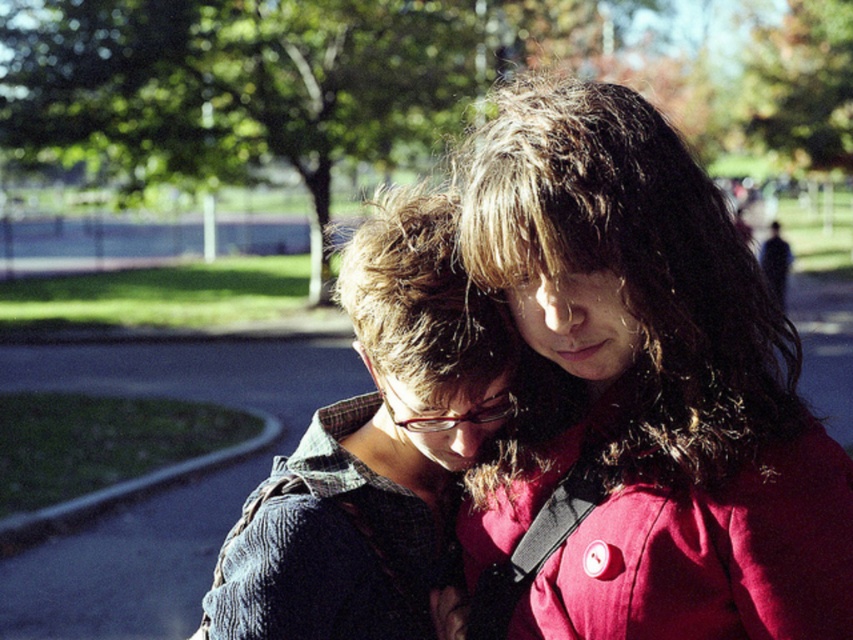
You are a photographer trying to capture the scene where the two people are interacting. You notice the matte blue sweater at center and the denim jacket at center. Which object should you focus on first if you want to capture the upper part of the subjects?

The matte blue sweater at center is located above the denim jacket at center, so you should focus on the matte blue sweater at center first to capture the upper part of the subjects.

Consider the image. You are standing in the park and see two people at the center wearing the matte blue sweater at center and the denim jacket at center. Which one is closer to you?

The matte blue sweater at center is closer to you since it is in front of the denim jacket at center.